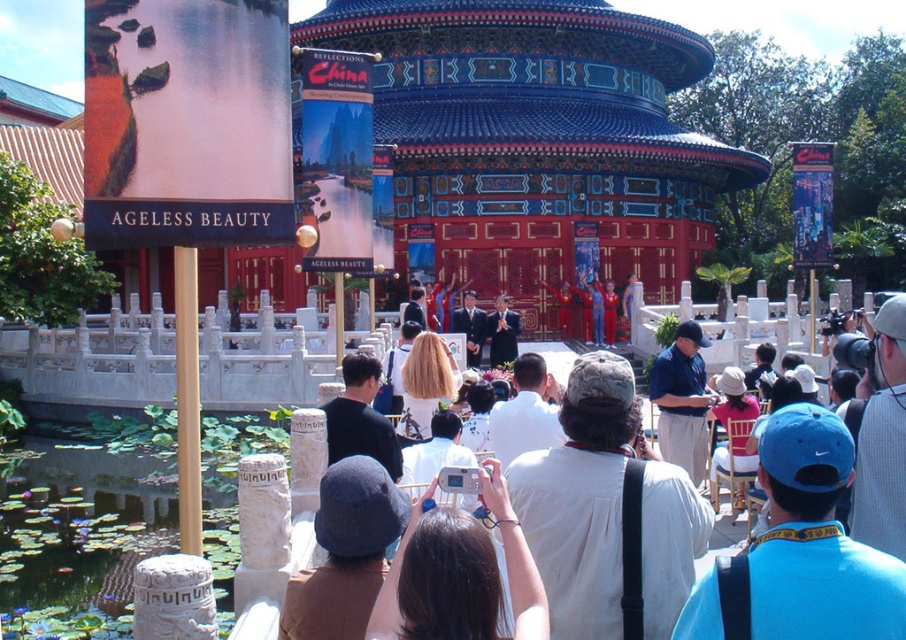
Question: Which of the following is the closest to the observer?

Choices:
 (A) (56, 595)
 (B) (422, 378)
 (C) (622, 611)
 (D) (371, 504)

Answer: (D)

Question: Can you confirm if camouflage hat at center is smaller than blonde hair at center?

Choices:
 (A) no
 (B) yes

Answer: (A)

Question: Can you confirm if green lily pads at lower left is bigger than blonde hair at center?

Choices:
 (A) no
 (B) yes

Answer: (B)

Question: Which object is closer to the camera taking this photo?

Choices:
 (A) green lily pads at lower left
 (B) blonde hair at center
 (C) blue fabric cap at center

Answer: (C)

Question: Can you confirm if white plastic camera at center is wider than blonde hair at center?

Choices:
 (A) no
 (B) yes

Answer: (A)

Question: Among these points, which one is farthest from the camera?

Choices:
 (A) (783, 467)
 (B) (18, 579)
 (C) (394, 621)

Answer: (B)